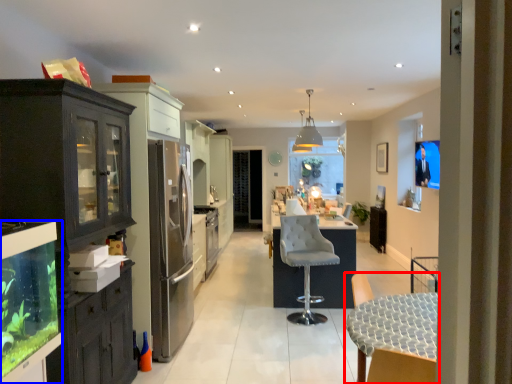
Question: Which point is further to the camera, chair (highlighted by a red box) or cabinetry (highlighted by a blue box)?

Choices:
 (A) chair
 (B) cabinetry

Answer: (A)